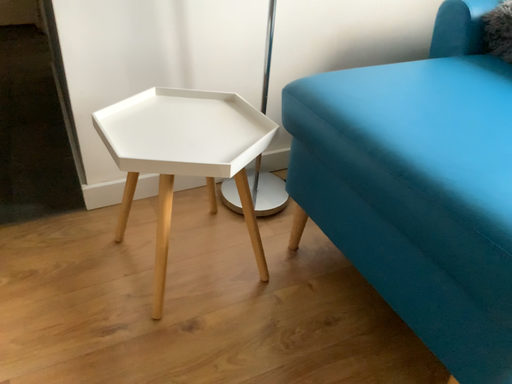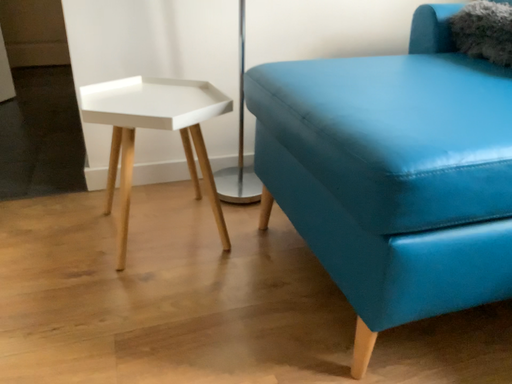
Question: How did the camera likely rotate when shooting the video?

Choices:
 (A) rotated upward
 (B) rotated downward

Answer: (A)